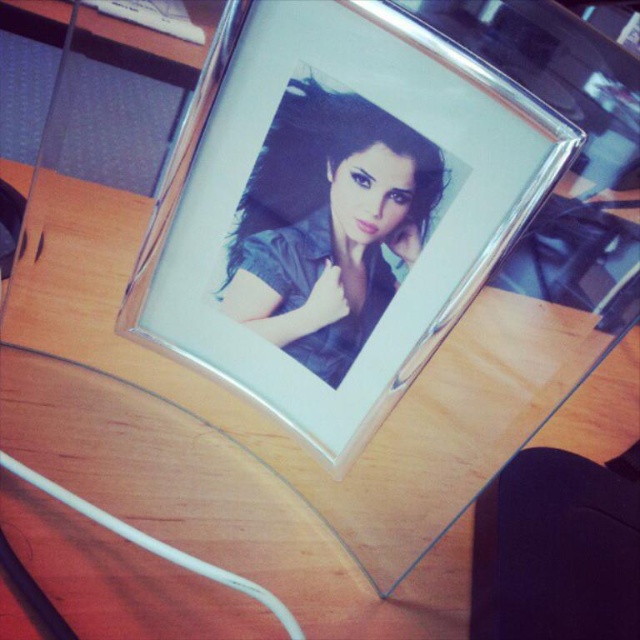
Question: Is silver metallic photo frame at center wider than satin black photo frame at center?

Choices:
 (A) no
 (B) yes

Answer: (B)

Question: Where is silver metallic photo frame at center located in relation to satin black photo frame at center in the image?

Choices:
 (A) above
 (B) below

Answer: (B)

Question: Is silver metallic photo frame at center to the right of satin black photo frame at center from the viewer's perspective?

Choices:
 (A) yes
 (B) no

Answer: (B)

Question: Which point is farther from the camera taking this photo?

Choices:
 (A) [468, 208]
 (B) [403, 232]

Answer: (B)

Question: Which point is farther to the camera?

Choices:
 (A) satin black photo frame at center
 (B) silver metallic photo frame at center

Answer: (A)